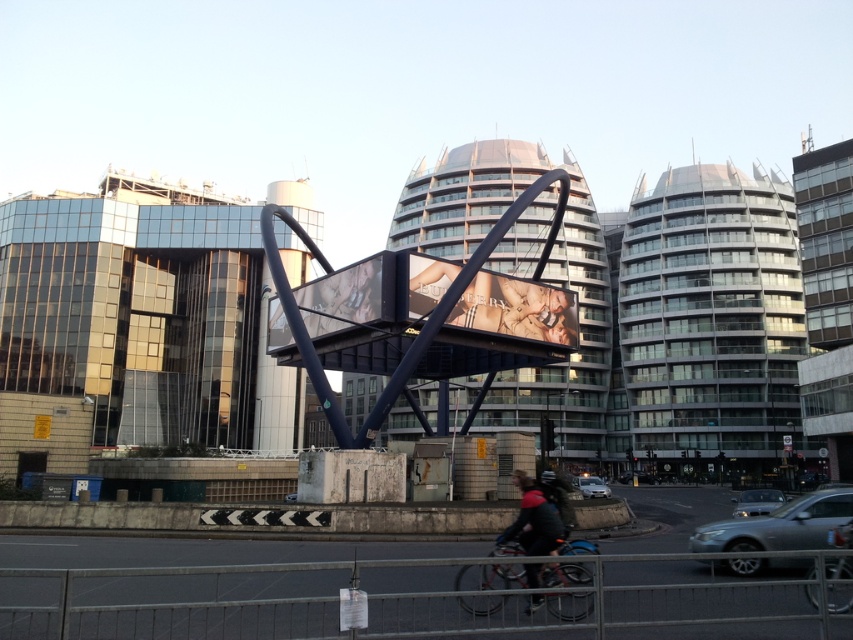
You are a pedestrian standing at the base of the sculpture. You see a dark gray jacket at lower center and a silver metallic car at center. Which object is closer to you?

The dark gray jacket at lower center is closer to you since it is only 19.59 meters away from the silver metallic car at center, implying the jacket is nearer to your position at the sculpture base.

You are a delivery person needing to load a dark gray jacket at lower center into the trunk of the silver metallic sedan at lower right. Can the jacket fit vertically in the trunk based on their heights?

The silver metallic sedan at lower right is much taller than the dark gray jacket at lower center, so the jacket can fit vertically in the trunk.